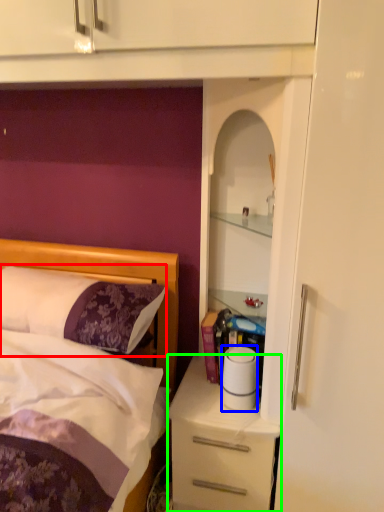
Question: Which object is positioned farthest from pillow (highlighted by a red box)? Select from toilet paper (highlighted by a blue box) and desk (highlighted by a green box).

Choices:
 (A) toilet paper
 (B) desk

Answer: (B)